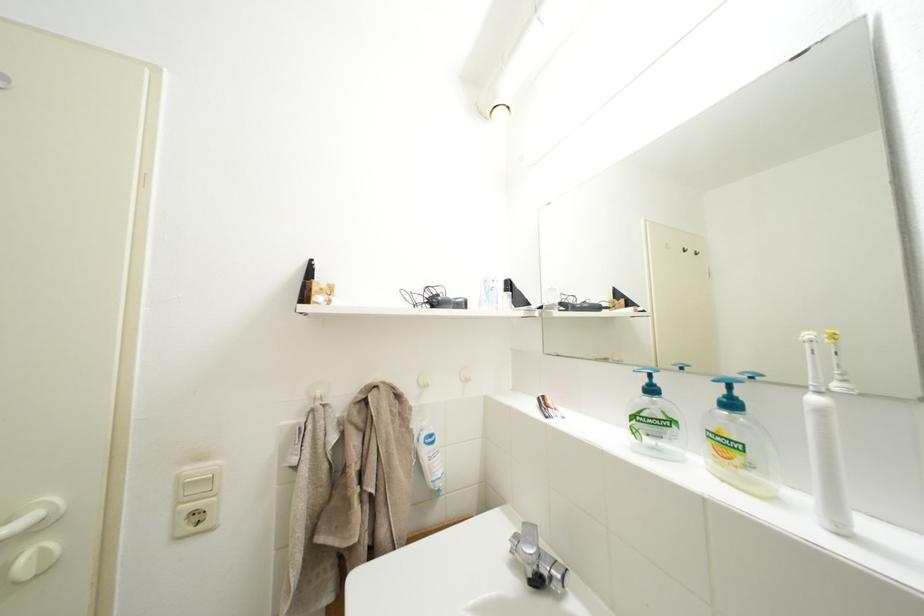
In order to click on faucet handle in this screenshot , I will do `click(529, 540)`.